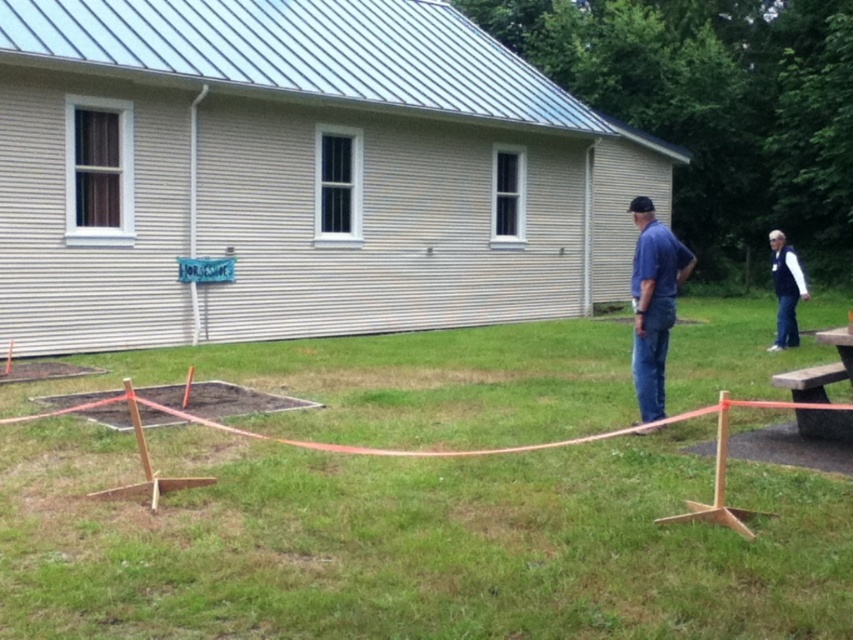
You are a gardener who wants to mow the green grass at center. However, you notice the blue denim jeans at center are in the way. Can you safely mow the grass without damaging the jeans?

The green grass at center has a lesser height compared to blue denim jeans at center, so the jeans are taller than the grass. This means the jeans are above the grass level, so the mower can pass under them without damaging the jeans.

Based on the photo, you are planning to place a picnic blanket on the green grass at center and the navy blue jacket at lower right. Which location has enough space to accommodate the blanket without folding it?

The green grass at center has a larger width than the navy blue jacket at lower right, so placing the picnic blanket on the green grass at center would provide enough space without needing to fold it.

You are a visitor at the Horse Show and see the green grass at center and the navy blue jacket at lower right. Which object is taller?

The navy blue jacket at lower right is taller than the green grass at center.